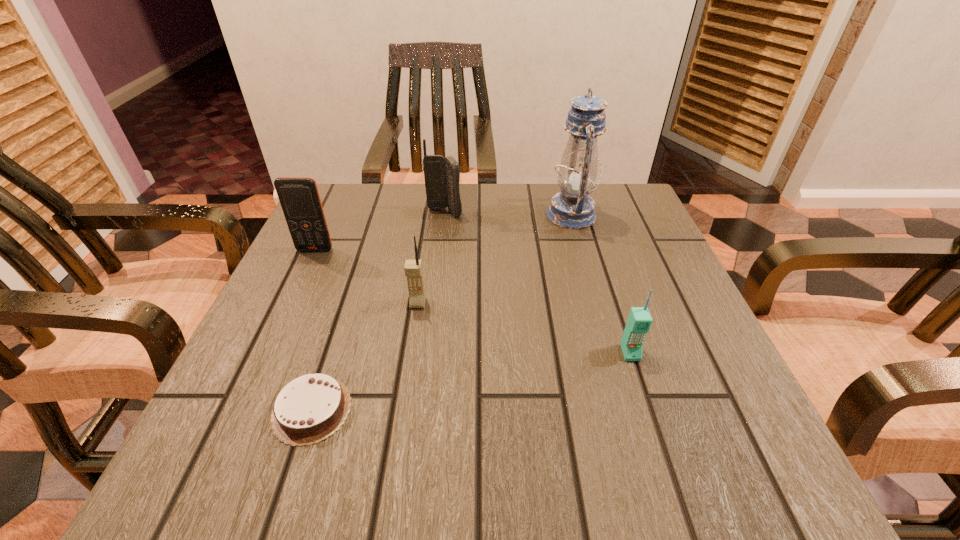
Locate an element on the screen. This screenshot has width=960, height=540. free spot between the farthest cellular telephone and the nearest object is located at coordinates (378, 311).

The width and height of the screenshot is (960, 540). Find the location of `empty space between the second farthest cellular telephone and the fourth farthest object`. empty space between the second farthest cellular telephone and the fourth farthest object is located at coordinates (367, 276).

Identify the location of empty space between the tallest object and the second object from left to right. (442, 312).

Identify the location of object that is the closest to the second object from left to right. The image size is (960, 540). (413, 269).

Find the location of a particular element. The height and width of the screenshot is (540, 960). object that can be found as the second closest to the lantern is located at coordinates [x=639, y=321].

Choose which cellular telephone is the nearest neighbor to the farthest cellular telephone. Please provide its 2D coordinates. Your answer should be formatted as a tuple, i.e. [(x, y)], where the tuple contains the x and y coordinates of a point satisfying the conditions above.

[(299, 197)]

Locate which cellular telephone is the second closest to the fourth nearest object. Please provide its 2D coordinates. Your answer should be formatted as a tuple, i.e. [(x, y)], where the tuple contains the x and y coordinates of a point satisfying the conditions above.

[(413, 269)]

Find the location of a particular element. The width and height of the screenshot is (960, 540). free space that satisfies the following two spatial constraints: 1. on the screen of the leftmost cellular telephone; 2. on the right side of the chocolate cake is located at coordinates (241, 410).

What are the coordinates of `vacant space that satisfies the following two spatial constraints: 1. on the front-facing side of the lantern; 2. on the front of the second nearest cellular telephone, where the keypad is located` in the screenshot? It's located at (596, 303).

Where is `blank space that satisfies the following two spatial constraints: 1. on the front-facing side of the lantern; 2. on the front side of the chocolate cake`? Image resolution: width=960 pixels, height=540 pixels. blank space that satisfies the following two spatial constraints: 1. on the front-facing side of the lantern; 2. on the front side of the chocolate cake is located at coordinates (626, 410).